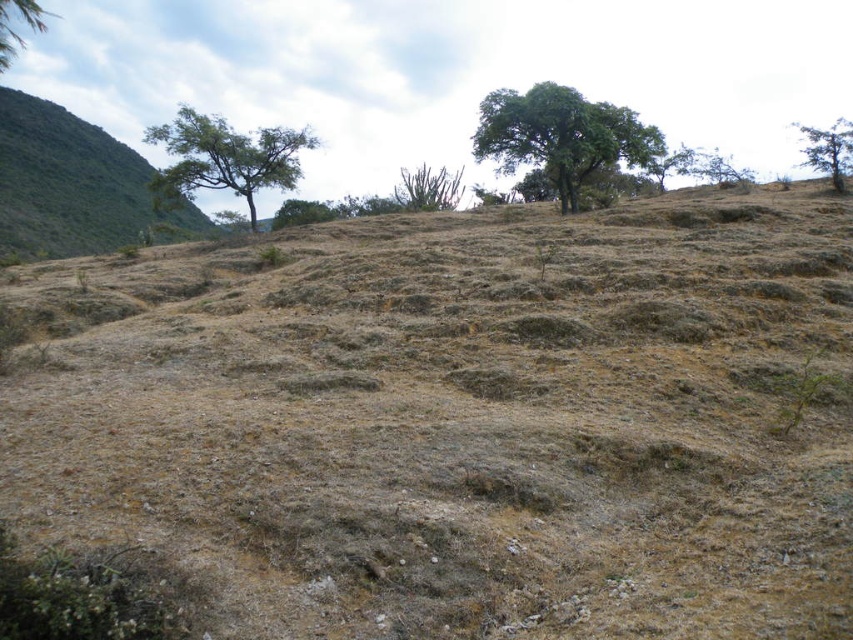
Between green leafy tree at upper center and green leafy tree at upper left, which one has less height?

With less height is green leafy tree at upper center.

Is point (538, 163) behind point (38, 12)?

Yes, it is behind point (38, 12).

Is point (525, 152) positioned behind point (1, 22)?

Yes, it is behind point (1, 22).

Find the location of a particular element. green leafy tree at upper center is located at coordinates (561, 136).

Between dried soil at center and green leafy tree at left, which one is positioned higher?

green leafy tree at left is above.

Measure the distance from dried soil at center to green leafy tree at left.

dried soil at center is 25.98 meters from green leafy tree at left.

Who is more forward, (654, 365) or (251, 138)?

Point (654, 365) is in front.

At what (x,y) coordinates should I click in order to perform the action: click on dried soil at center. Please return your answer as a coordinate pair (x, y). Looking at the image, I should click on [466, 420].

Does point (582, 180) come in front of point (798, 132)?

Yes, it is in front of point (798, 132).

Looking at this image, between green leafy tree at upper center and green leafy tree at upper right, which one is positioned higher?

green leafy tree at upper right is higher up.

Does point (575, 161) come in front of point (808, 163)?

Yes, it is.

Where is `green leafy tree at upper center`? green leafy tree at upper center is located at coordinates [561, 136].